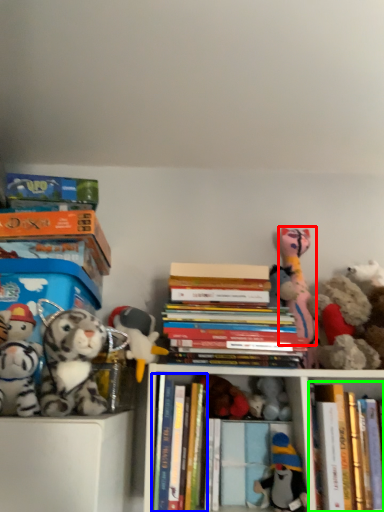
Question: Which object is positioned closest to toy (highlighted by a red box)? Select from book (highlighted by a blue box) and book (highlighted by a green box).

Choices:
 (A) book
 (B) book

Answer: (B)